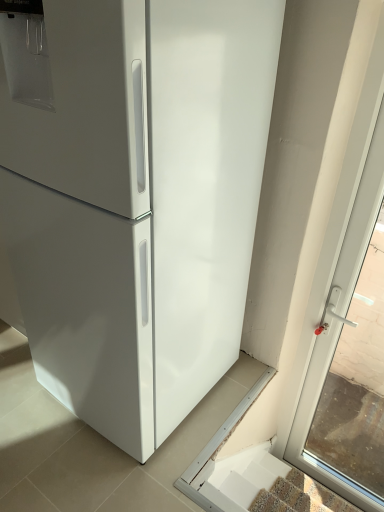
Question: Would you say white plastic door handle at right is outside white glossy stairs at lower right?

Choices:
 (A) yes
 (B) no

Answer: (A)

Question: From the image's perspective, does white plastic door handle at right appear lower than white glossy stairs at lower right?

Choices:
 (A) no
 (B) yes

Answer: (A)

Question: Is white plastic door handle at right behind white glossy stairs at lower right?

Choices:
 (A) no
 (B) yes

Answer: (A)

Question: Considering the relative sizes of white plastic door handle at right and white glossy stairs at lower right in the image provided, is white plastic door handle at right shorter than white glossy stairs at lower right?

Choices:
 (A) yes
 (B) no

Answer: (B)

Question: Is white plastic door handle at right smaller than white glossy stairs at lower right?

Choices:
 (A) yes
 (B) no

Answer: (B)

Question: From a real-world perspective, is white plastic door handle at right below white glossy stairs at lower right?

Choices:
 (A) yes
 (B) no

Answer: (B)

Question: Can you confirm if white glossy stairs at lower right is shorter than white plastic door handle at right?

Choices:
 (A) no
 (B) yes

Answer: (B)

Question: Is white plastic door handle at right inside white glossy stairs at lower right?

Choices:
 (A) no
 (B) yes

Answer: (A)

Question: Is white glossy stairs at lower right wider than white plastic door handle at right?

Choices:
 (A) yes
 (B) no

Answer: (A)

Question: Could you tell me if white glossy stairs at lower right is facing white plastic door handle at right?

Choices:
 (A) no
 (B) yes

Answer: (B)

Question: Can you confirm if white glossy stairs at lower right is taller than white plastic door handle at right?

Choices:
 (A) no
 (B) yes

Answer: (A)

Question: Is the position of white glossy stairs at lower right more distant than that of white plastic door handle at right?

Choices:
 (A) yes
 (B) no

Answer: (A)

Question: From the image's perspective, is white glossy stairs at lower right above or below white plastic door handle at right?

Choices:
 (A) above
 (B) below

Answer: (B)